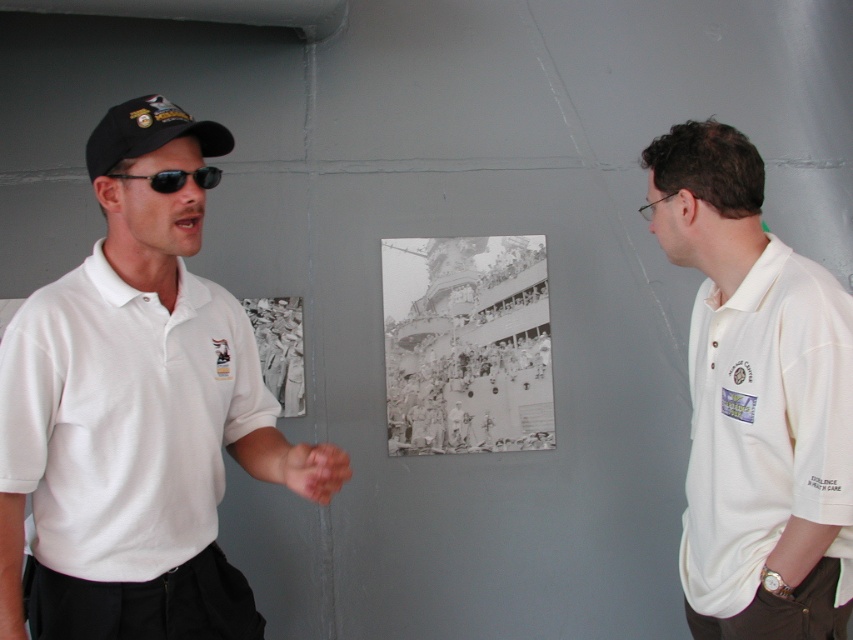
Which is above, black fabric baseball cap at left or pink flesh-toned hand at center?

black fabric baseball cap at left is higher up.

The image size is (853, 640). Describe the element at coordinates (148, 132) in the screenshot. I see `black fabric baseball cap at left` at that location.

Is point (137, 154) positioned after point (306, 468)?

No.

In order to click on black fabric baseball cap at left in this screenshot , I will do `click(148, 132)`.

Is point (155, 125) closer to camera compared to point (173, 186)?

Yes, point (155, 125) is closer to viewer.

Does black fabric baseball cap at left lie in front of black reflective sunglasses at left?

Yes, it is in front of black reflective sunglasses at left.

Is point (102, 173) farther from viewer compared to point (154, 177)?

Yes, it is behind point (154, 177).

What are the coordinates of `black fabric baseball cap at left` in the screenshot? It's located at (148, 132).

Looking at this image, who is positioned more to the right, pink flesh-toned hand at center or black reflective sunglasses at left?

From the viewer's perspective, pink flesh-toned hand at center appears more on the right side.

Between point (338, 448) and point (160, 189), which one is positioned in front?

Point (160, 189) is in front.

What do you see at coordinates (306, 468) in the screenshot? The width and height of the screenshot is (853, 640). I see `pink flesh-toned hand at center` at bounding box center [306, 468].

Image resolution: width=853 pixels, height=640 pixels. Identify the location of pink flesh-toned hand at center. (306, 468).